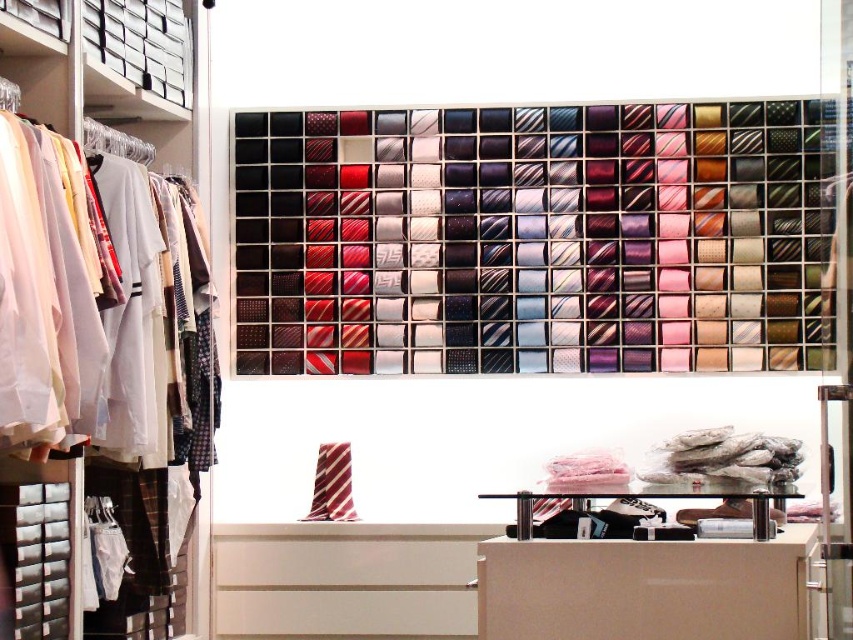
You are a customer in a men clothing store looking at the tie display. You want to find the striped fabric tie at center. Where should you look relative to the silky woven ties at upper center?

The striped fabric tie at center is located below the silky woven ties at upper center.

You are a customer in a men clothing store. You see the silky woven ties at upper center and the striped fabric tie at center. Which one is higher up on the wall?

The silky woven ties at upper center is higher up on the wall than the striped fabric tie at center.

You are a customer in the store and want to locate the silky woven ties at upper center. Based on the store layout described, where should you look relative to the shirts rack on the left?

The silky woven ties at upper center are located to the right of the shirts rack on the left, as they are part of the wall display described in the scene.